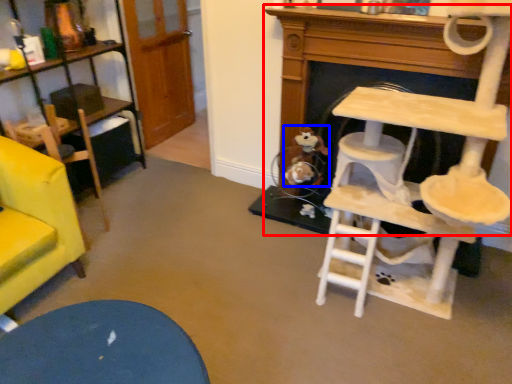
Question: Which of the following is the closest to the observer, fireplace (highlighted by a red box) or toy (highlighted by a blue box)?

Choices:
 (A) fireplace
 (B) toy

Answer: (A)